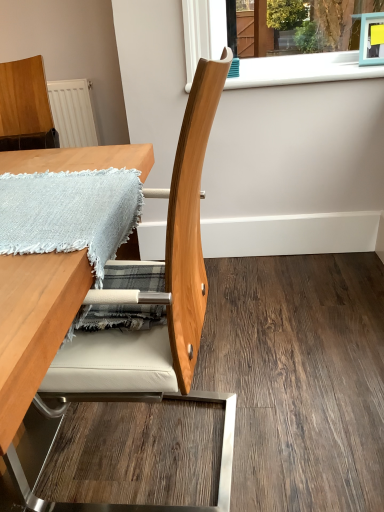
Measure the distance between light blue woven blanket at upper left and camera.

light blue woven blanket at upper left is 25.09 inches away from camera.

The width and height of the screenshot is (384, 512). What do you see at coordinates (70, 213) in the screenshot?
I see `light blue woven blanket at upper left` at bounding box center [70, 213].

Measure the distance between point (x=6, y=274) and camera.

Point (x=6, y=274) is 22.99 inches from camera.

Where is `wooden chair at center`? wooden chair at center is located at coordinates (168, 306).

This screenshot has width=384, height=512. What are the coordinates of `light blue woven blanket at upper left` in the screenshot? It's located at (70, 213).

I want to click on window sill lying behind the wooden chair at center, so click(302, 70).

Which of these two, wooden chair at center or white plastic window sill at upper center, is wider?

With larger width is wooden chair at center.

From a real-world perspective, who is located lower, wooden chair at center or white plastic window sill at upper center?

wooden chair at center.

Between wooden chair at center and white plastic window sill at upper center, which one appears on the left side from the viewer's perspective?

From the viewer's perspective, wooden chair at center appears more on the left side.

Is point (231, 314) positioned after point (301, 73)?

No.

Is natural wood chair at center next to white plastic window sill at upper center and touching it?

They are not placed beside each other.

Looking at the image, does natural wood chair at center seem bigger or smaller compared to white plastic window sill at upper center?

Clearly, natural wood chair at center is larger in size than white plastic window sill at upper center.

Considering the relative sizes of natural wood chair at center and white plastic window sill at upper center in the image provided, is natural wood chair at center thinner than white plastic window sill at upper center?

In fact, natural wood chair at center might be wider than white plastic window sill at upper center.

Based on their positions, is wooden table at center located to the left or right of natural wood chair at center?

Based on their positions, wooden table at center is located to the left of natural wood chair at center.

Can you confirm if wooden table at center is wider than natural wood chair at center?

No, wooden table at center is not wider than natural wood chair at center.

Is natural wood chair at center at the back of wooden table at center?

Absolutely, wooden table at center is directed away from natural wood chair at center.

Measure the distance from wooden table at center to natural wood chair at center.

They are 31.40 inches apart.

From a real-world perspective, is wooden chair at center over wooden table at center?

Yes.

Choose the correct answer: Is wooden chair at center inside wooden table at center or outside it?

wooden chair at center fits inside wooden table at center.

Does wooden chair at center have a larger size compared to wooden table at center?

Incorrect, wooden chair at center is not larger than wooden table at center.

Looking at this image, is wooden chair at center aimed at wooden table at center?

Answer: Yes, wooden chair at center is oriented towards wooden table at center.

At what (x,y) coordinates should I click in order to perform the action: click on table in front of the natural wood chair at center. Please return your answer as a coordinate pair (x, y). Looking at the image, I should click on (34, 325).

Is natural wood chair at center turned away from wooden table at center?

No, natural wood chair at center is not facing the opposite direction of wooden table at center.

Is natural wood chair at center outside of wooden table at center?

Yes, natural wood chair at center is not within wooden table at center.

From a real-world perspective, is natural wood chair at center located beneath wooden table at center?

Yes, from a real-world perspective, natural wood chair at center is below wooden table at center.

Is wooden table at center not within white plastic window sill at upper center?

Yes.

Is wooden table at center at the left side of white plastic window sill at upper center?

Correct, you'll find wooden table at center to the left of white plastic window sill at upper center.

Between point (23, 369) and point (300, 80), which one is positioned behind?

The point (300, 80) is more distant.

The image size is (384, 512). Identify the location of table on the left of white plastic window sill at upper center. (34, 325).

Would you say wooden chair at center is inside or outside light blue woven blanket at upper left?

wooden chair at center is not enclosed by light blue woven blanket at upper left.

Which point is more forward, (190,232) or (97,190)?

The point (97,190) is closer.

Is wooden chair at center smaller than light blue woven blanket at upper left?

No.

Which of these two, wooden chair at center or light blue woven blanket at upper left, stands shorter?

light blue woven blanket at upper left.

Where is `window sill above the wooden chair at center (from a real-world perspective)`? This screenshot has width=384, height=512. window sill above the wooden chair at center (from a real-world perspective) is located at coordinates (302, 70).

The width and height of the screenshot is (384, 512). I want to click on window sill above the natural wood chair at center (from the image's perspective), so click(x=302, y=70).

Estimate the real-world distances between objects in this image. Which object is further from white plastic window sill at upper center, natural wood chair at center or wooden table at center?

natural wood chair at center lies further to white plastic window sill at upper center than the other object.

Considering their positions, is light blue woven blanket at upper left positioned further to white plastic window sill at upper center than natural wood chair at center?

natural wood chair at center.

From the image, which object appears to be farther from white plastic window sill at upper center, natural wood chair at center or wooden chair at center?

wooden chair at center is further to white plastic window sill at upper center.

From the image, which object appears to be nearer to light blue woven blanket at upper left, white plastic window sill at upper center or wooden table at center?

wooden table at center.

Considering their positions, is light blue woven blanket at upper left positioned closer to wooden chair at center than white plastic window sill at upper center?

Among the two, light blue woven blanket at upper left is located nearer to wooden chair at center.

Which object lies nearer to the anchor point wooden table at center, white plastic window sill at upper center or wooden chair at center?

wooden chair at center lies closer to wooden table at center than the other object.

From the image, which object appears to be farther from wooden table at center, wooden chair at center or light blue woven blanket at upper left?

Among the two, wooden chair at center is located further to wooden table at center.

Based on their spatial positions, is wooden table at center or natural wood chair at center closer to white plastic window sill at upper center?

The object closer to white plastic window sill at upper center is wooden table at center.

The image size is (384, 512). Identify the location of blanket between wooden table at center and white plastic window sill at upper center in the front-back direction. (70, 213).

Where is `plywood between wooden chair at center and white plastic window sill at upper center in the front-back direction`? The image size is (384, 512). plywood between wooden chair at center and white plastic window sill at upper center in the front-back direction is located at coordinates click(x=300, y=378).

This screenshot has height=512, width=384. I want to click on chair between light blue woven blanket at upper left and wooden table at center in the vertical direction, so click(168, 306).

The width and height of the screenshot is (384, 512). Find the location of `chair between light blue woven blanket at upper left and natural wood chair at center in the horizontal direction`. chair between light blue woven blanket at upper left and natural wood chair at center in the horizontal direction is located at coordinates (168, 306).